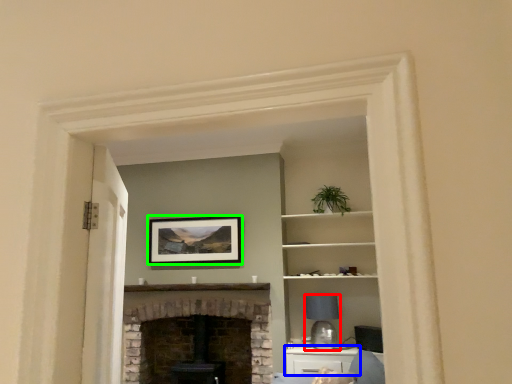
Question: Which object is positioned farthest from lamp (highlighted by a red box)? Select from cabinetry (highlighted by a blue box) and picture frame (highlighted by a green box).

Choices:
 (A) cabinetry
 (B) picture frame

Answer: (B)